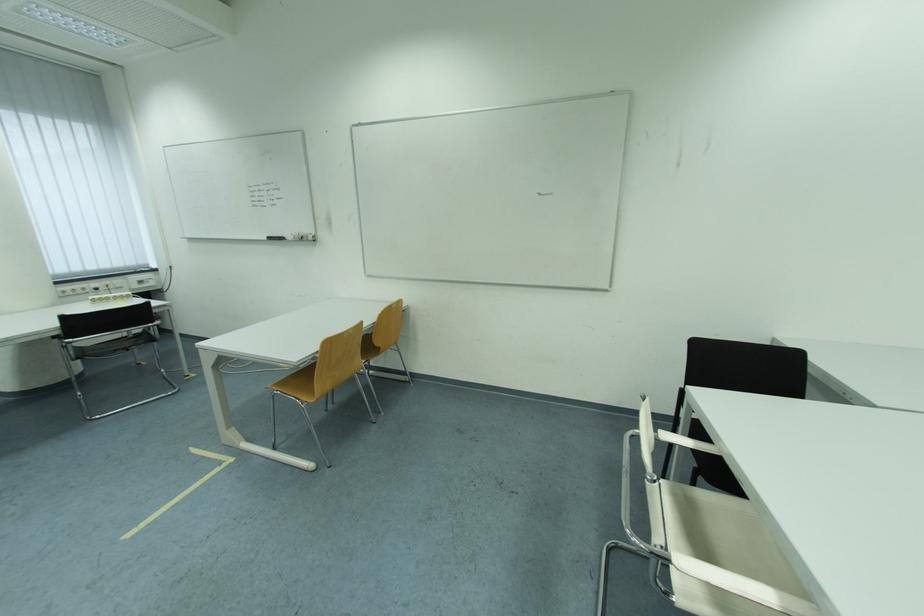
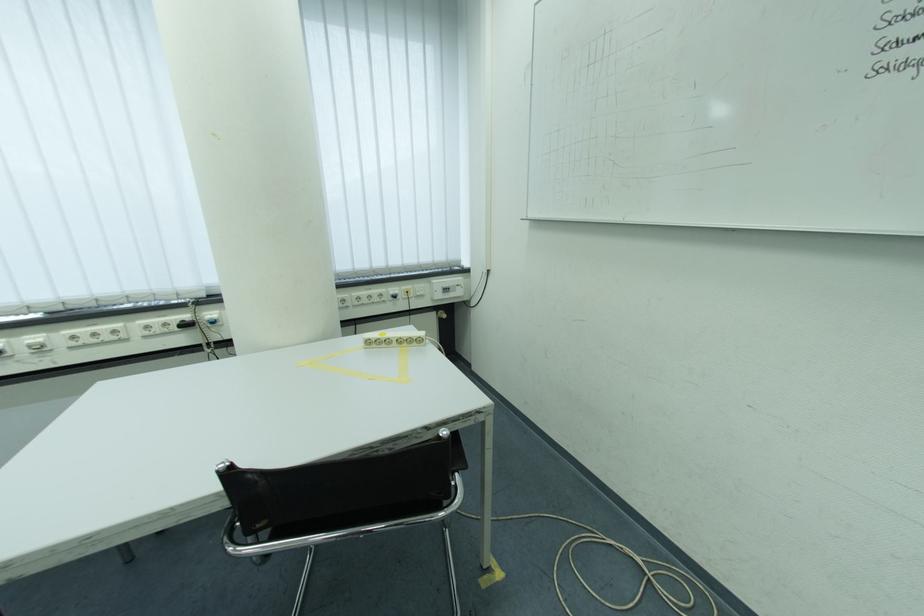
Where in the second image is the point corresponding to (150,285) from the first image?

(455, 292)